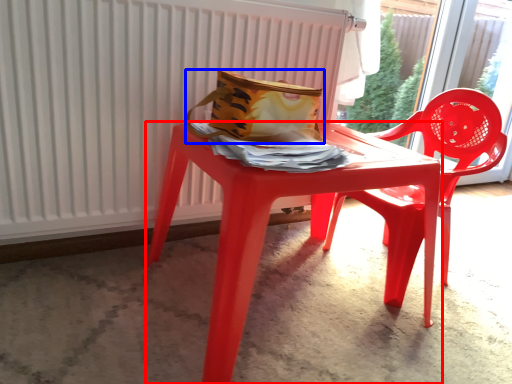
Question: Which point is closer to the camera, table (highlighted by a red box) or bag (highlighted by a blue box)?

Choices:
 (A) table
 (B) bag

Answer: (A)